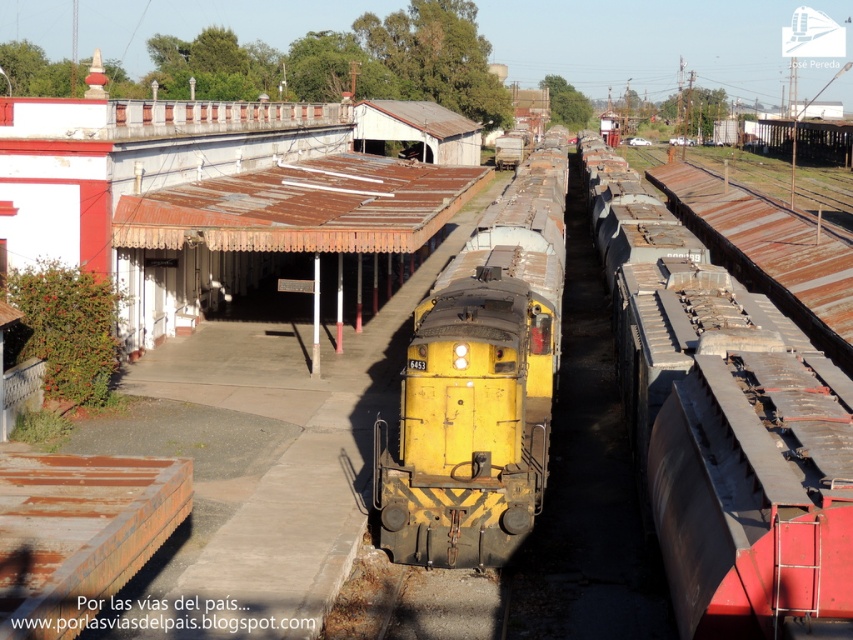
Question: Which point is farther from the camera taking this photo?

Choices:
 (A) (672, 516)
 (B) (509, 506)

Answer: (B)

Question: Is rusty metal train car at right to the right of yellow matte train at center from the viewer's perspective?

Choices:
 (A) no
 (B) yes

Answer: (B)

Question: Which point is farther from the camera taking this photo?

Choices:
 (A) (828, 570)
 (B) (403, 515)

Answer: (B)

Question: Observing the image, what is the correct spatial positioning of rusty metal train car at right in reference to yellow matte train at center?

Choices:
 (A) above
 (B) below

Answer: (B)

Question: Can you confirm if rusty metal train car at right is positioned to the left of yellow matte train at center?

Choices:
 (A) no
 (B) yes

Answer: (A)

Question: Among these objects, which one is nearest to the camera?

Choices:
 (A) rusty metal train car at right
 (B) yellow matte train at center

Answer: (A)